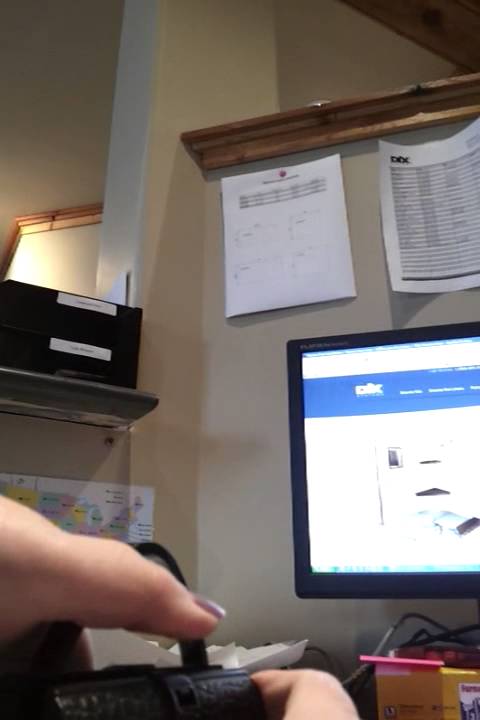
Locate an element on the screen. cords is located at coordinates (398, 620), (431, 636), (322, 649).